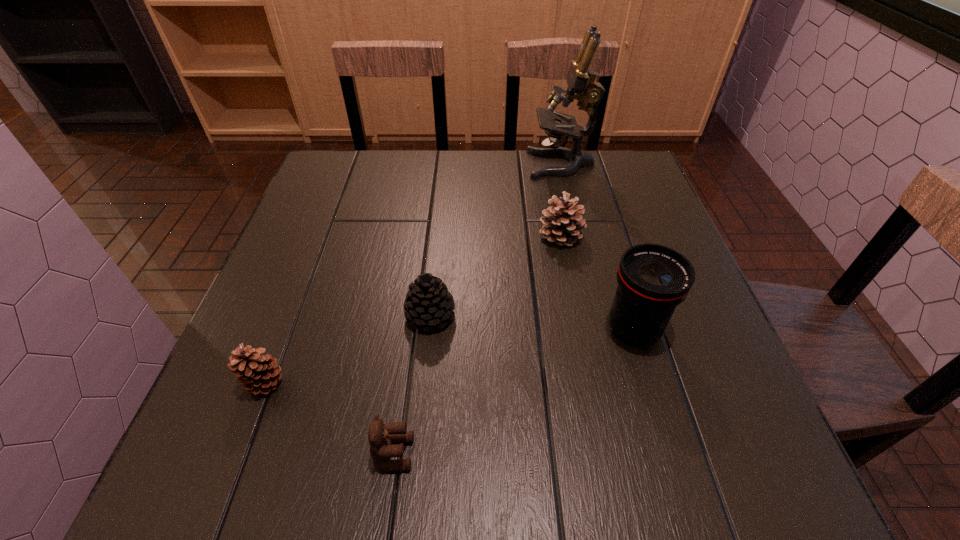
I want to click on vacant point located between the leftmost pinecone and the microscope, so click(x=413, y=274).

Locate an element on the screen. The width and height of the screenshot is (960, 540). vacant point located between the farthest object and the second farthest object is located at coordinates (561, 200).

I want to click on free point between the farthest object and the farthest pinecone, so click(x=561, y=200).

In order to click on unoccupied area between the second nearest object and the nearest object in this screenshot , I will do `click(329, 418)`.

Locate an element on the screen. The height and width of the screenshot is (540, 960). unoccupied position between the nearest pinecone and the second tallest object is located at coordinates click(448, 356).

What are the coordinates of `empty space that is in between the telephoto lens and the tallest object` in the screenshot? It's located at (597, 247).

This screenshot has height=540, width=960. In order to click on vacant region between the telephoto lens and the second farthest pinecone in this screenshot , I will do `click(532, 322)`.

The image size is (960, 540). I want to click on free space between the teddy bear and the second farthest pinecone, so click(412, 384).

Image resolution: width=960 pixels, height=540 pixels. What are the coordinates of `object identified as the second closest to the nearest object` in the screenshot? It's located at (428, 303).

Find the location of a particular element. The image size is (960, 540). object that is the fifth closest to the second pinecone from right to left is located at coordinates (580, 79).